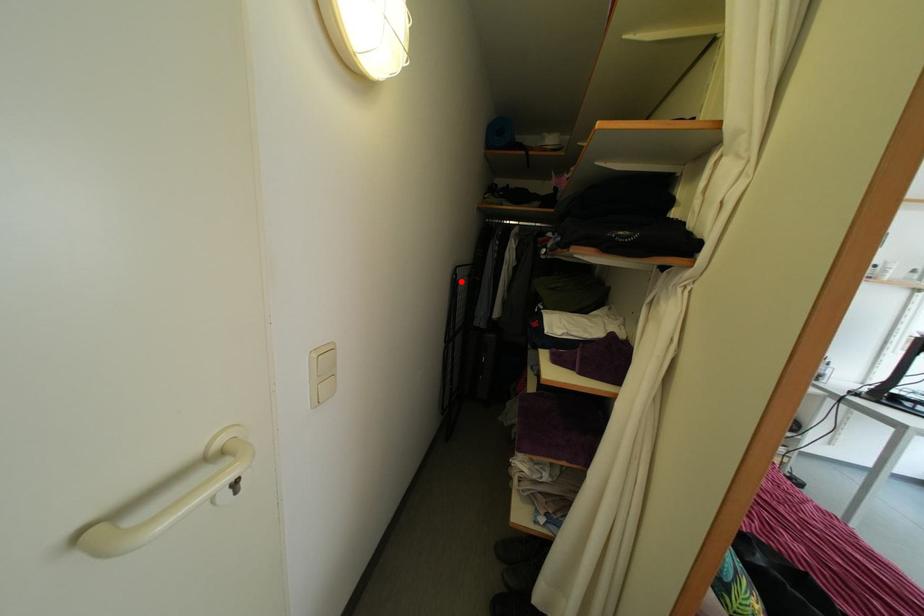
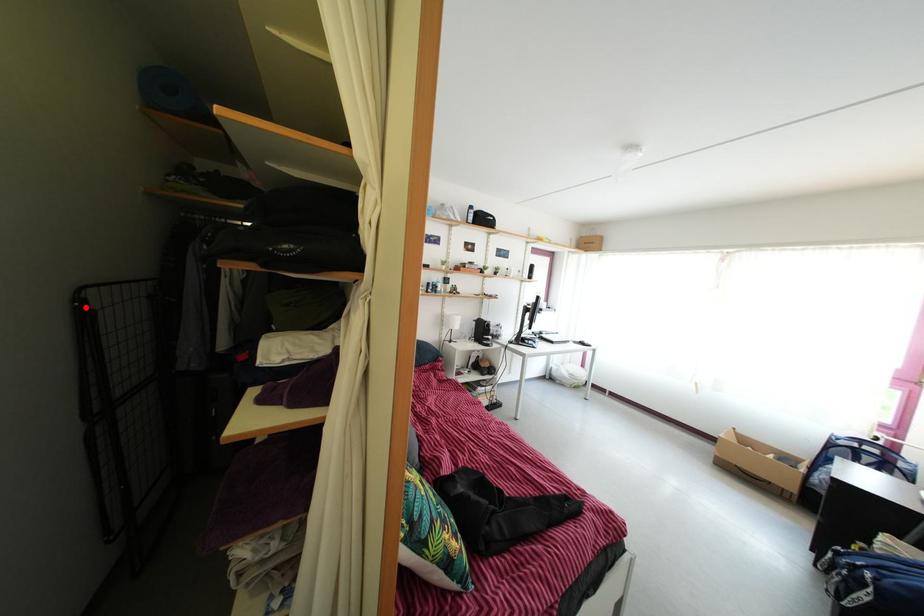
I am providing you with two images of the same scene from different viewpoints. A red point is marked on the first image and another point is marked on the second image. Does the point marked in image1 correspond to the same location as the one in image2?

Yes